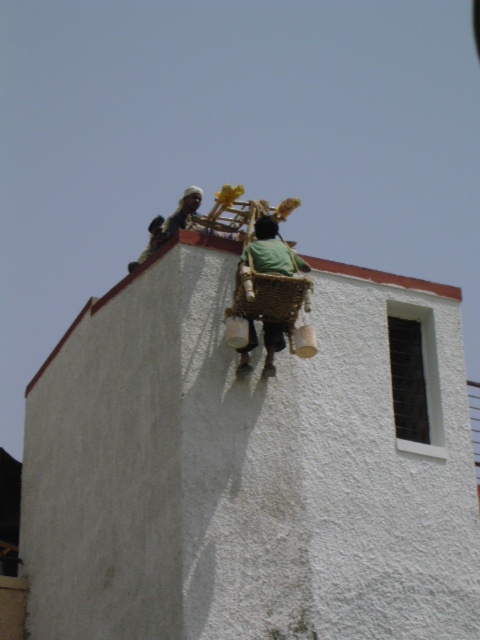
Who is shorter, green woven basket at upper center or light brown wicker basket at upper center?

green woven basket at upper center

Is green woven basket at upper center further to camera compared to light brown wicker basket at upper center?

No, green woven basket at upper center is in front of light brown wicker basket at upper center.

What do you see at coordinates (267, 256) in the screenshot? The width and height of the screenshot is (480, 640). I see `green woven basket at upper center` at bounding box center [267, 256].

Image resolution: width=480 pixels, height=640 pixels. What are the coordinates of `green woven basket at upper center` in the screenshot? It's located at (267, 256).